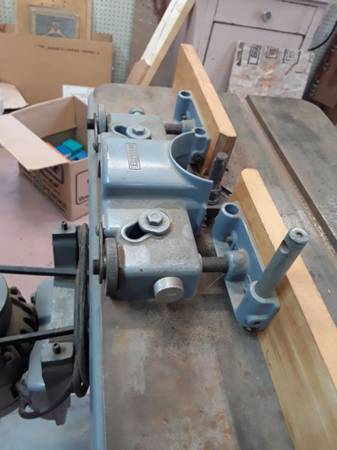
Find the location of a particular element. Image resolution: width=337 pixels, height=450 pixels. power cord is located at coordinates (60, 401).